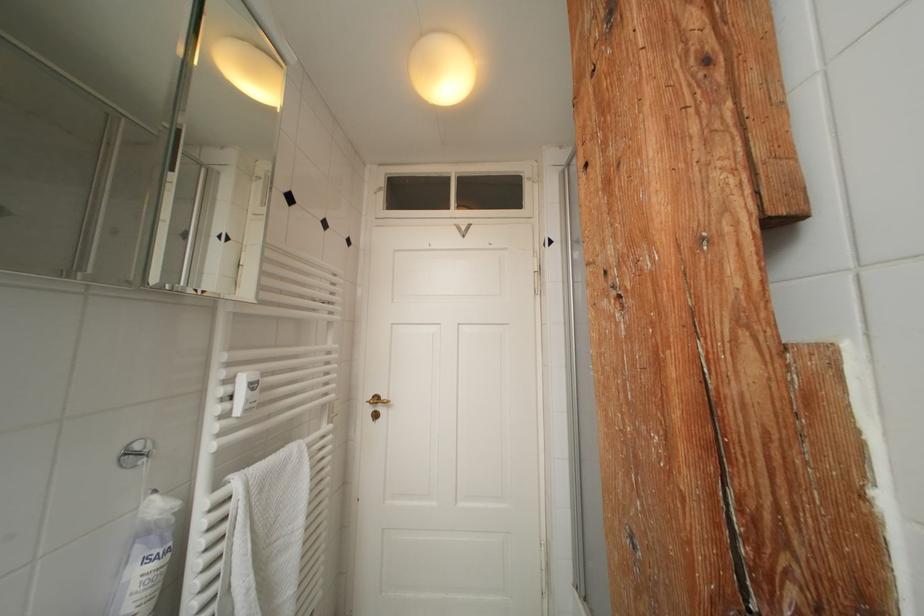
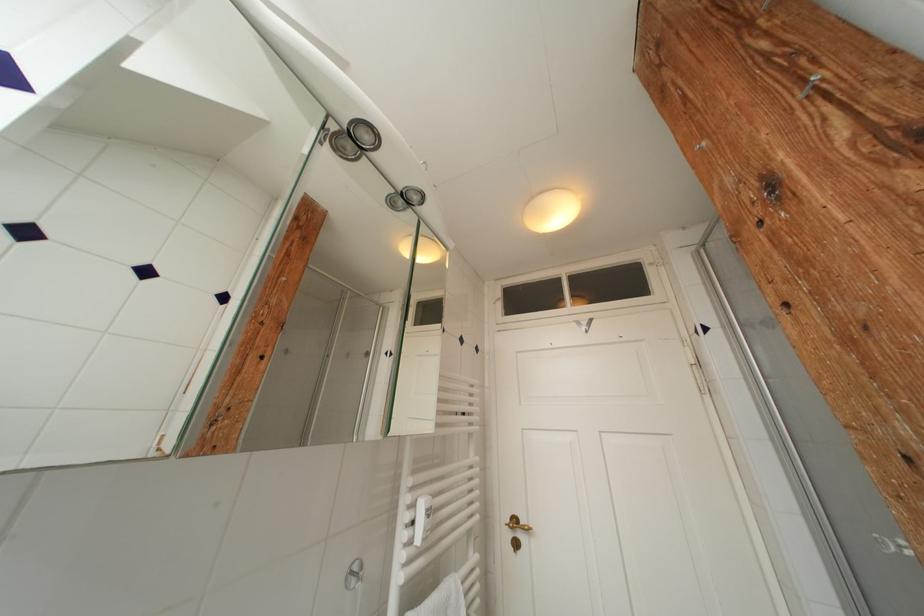
In the second image, find the point that corresponds to (x=383, y=402) in the first image.

(521, 525)